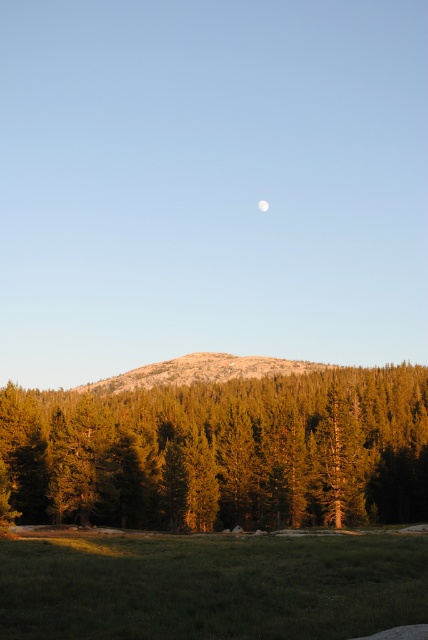
You are standing at the point with coordinates point (158, 376) and want to walk towards the point with coordinates point (261, 205). According to the scene, will you be moving towards the mountain in the background?

Yes, because point (158, 376) is in front of point (261, 205), which is closer to the mountain in the background.

You are an astronomer observing the night sky and notice the granite rock at center and the white matte moon at upper center. Which object is bigger in the image?

The granite rock at center is larger in size than the white matte moon at upper center, so the granite rock at center appears bigger in the image.